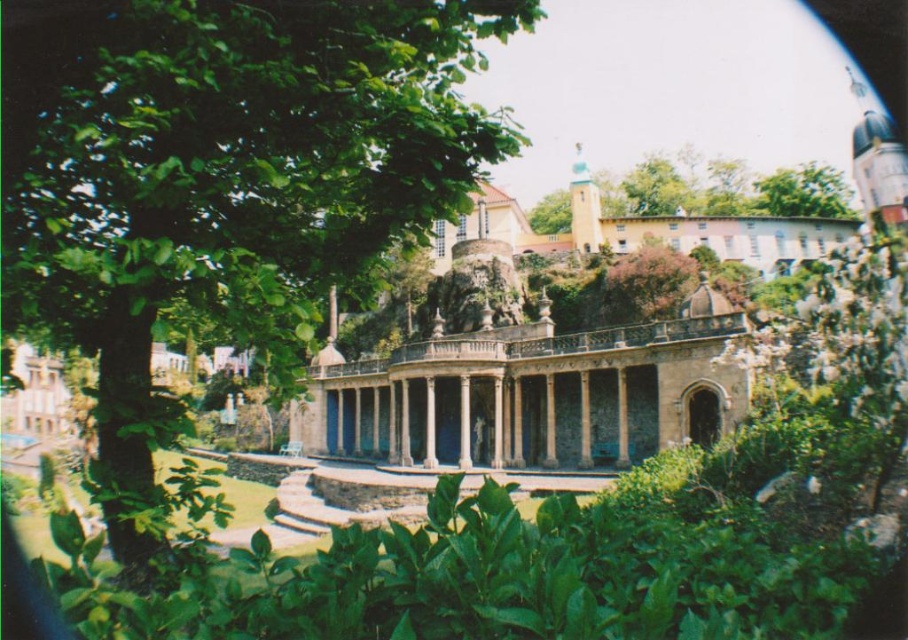
You are an architect analyzing the layout of the pavilion area. You observe the green leafy tree at center and the green leafy tree at upper right. Which tree has a larger spread in terms of width?

The green leafy tree at center has a larger spread in terms of width than the green leafy tree at upper right.

You are standing at the entrance of the classical pavilion and want to reach a specific location marked by two points in the scene. The first point is at coordinates point (104,90) and the second is at point (798,172). Which point is closer to you as you face the pavilion?

Point (104,90) is closer to the viewer than point (798,172).